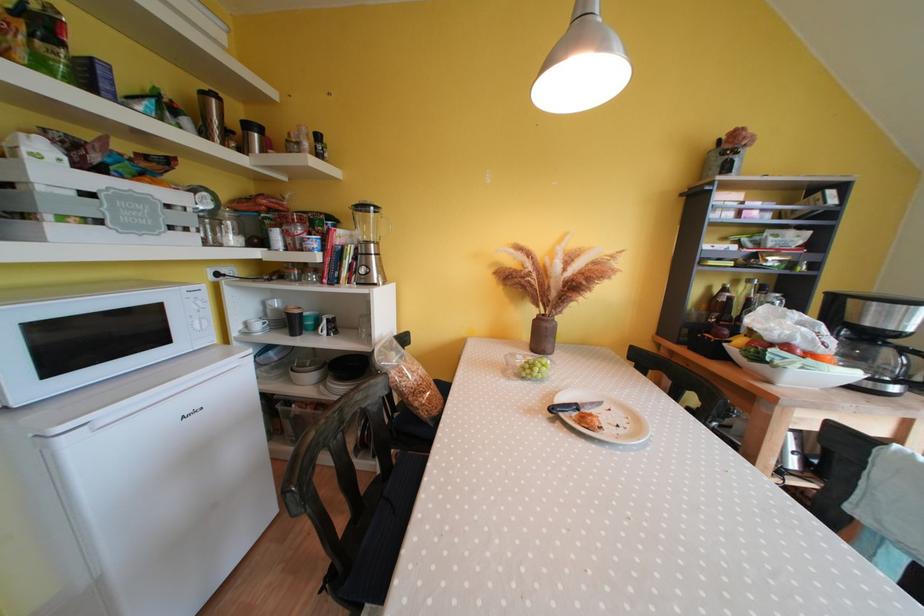
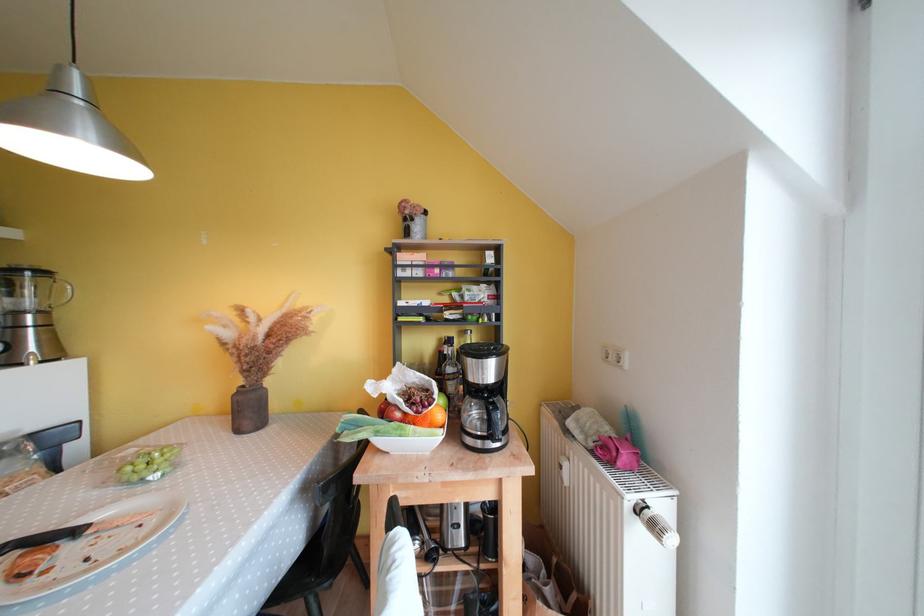
Locate, in the second image, the point that corresponds to pixel 383 246 in the first image.

(49, 315)